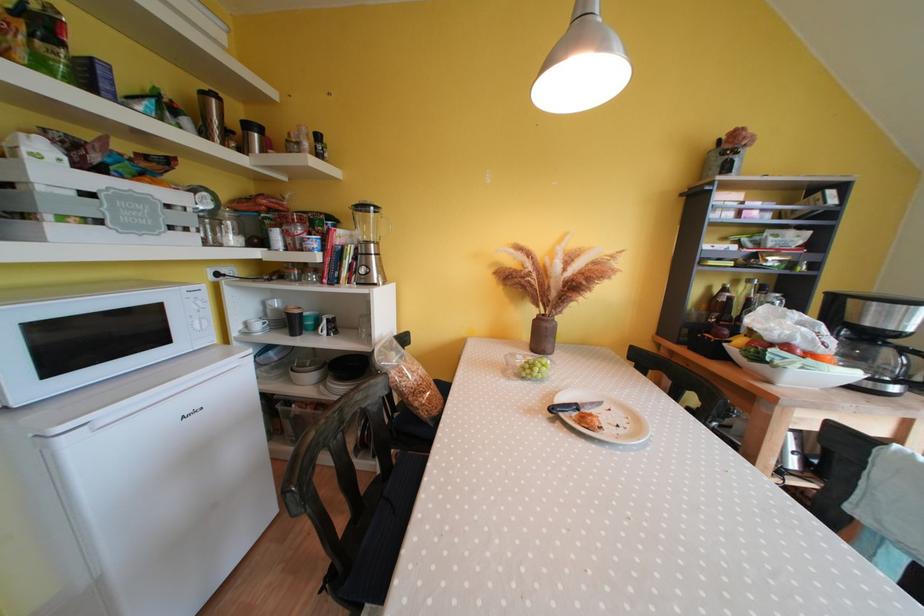
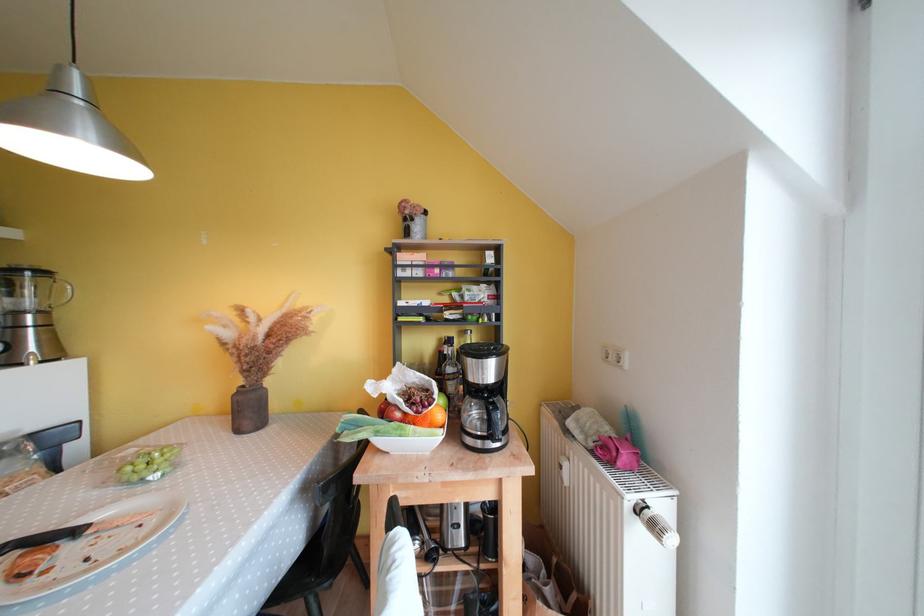
Locate, in the second image, the point that corresponds to pixel 383 246 in the first image.

(49, 315)